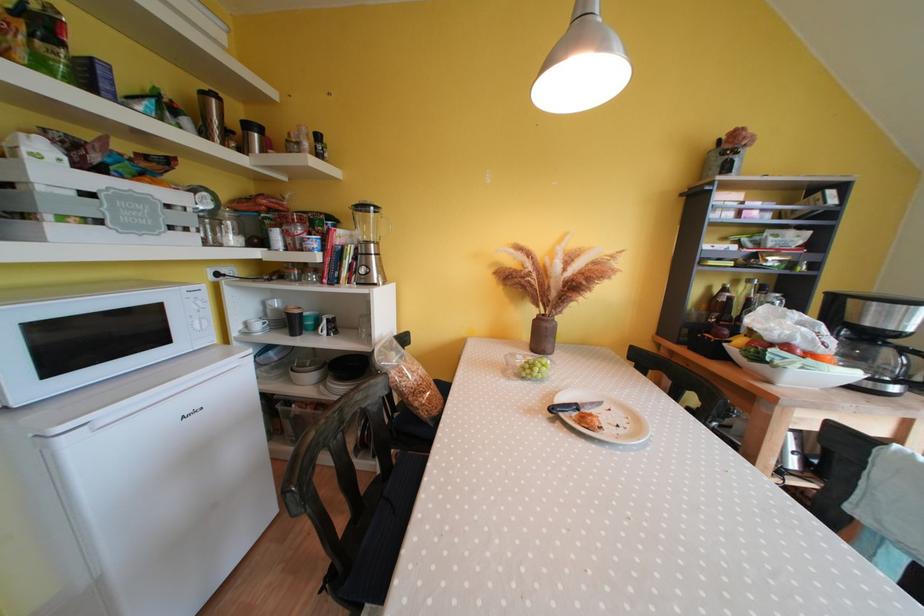
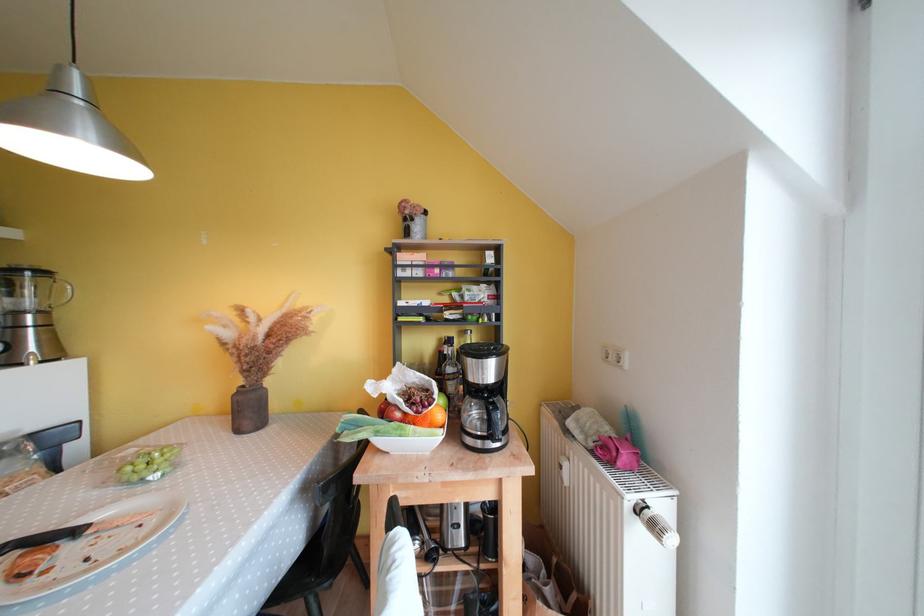
Locate, in the second image, the point that corresponds to pixel 383 246 in the first image.

(49, 315)